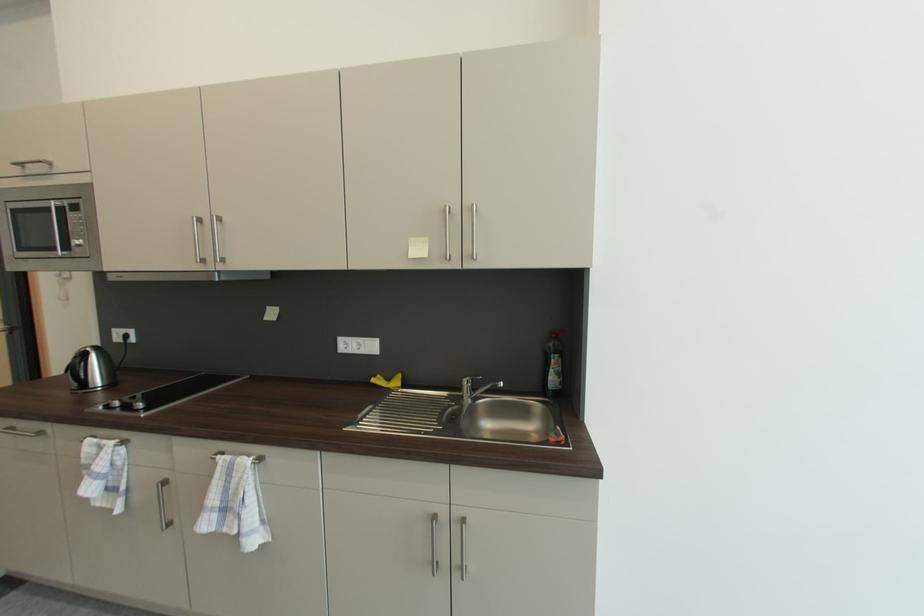
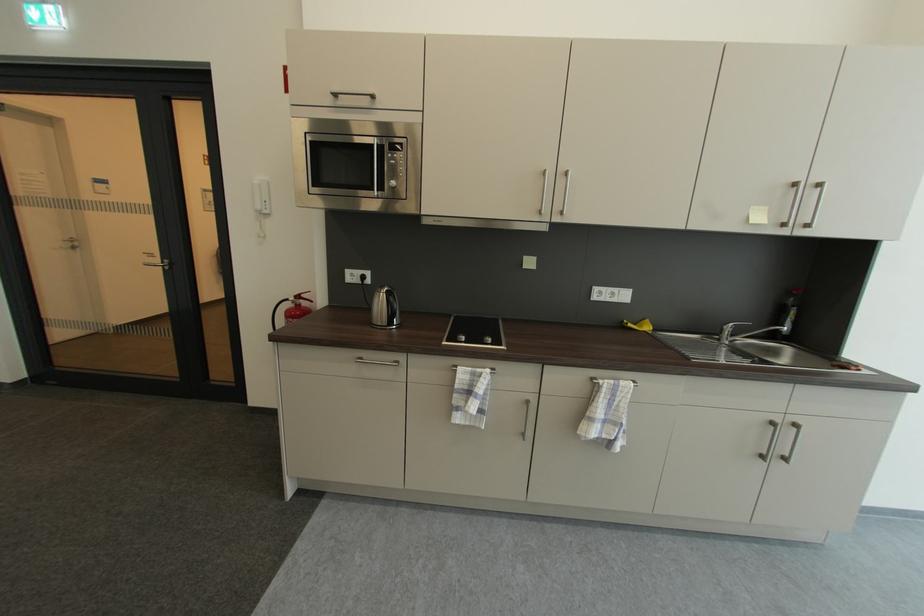
Locate, in the second image, the point that corresponds to the point at 83,362 in the first image.

(397, 301)